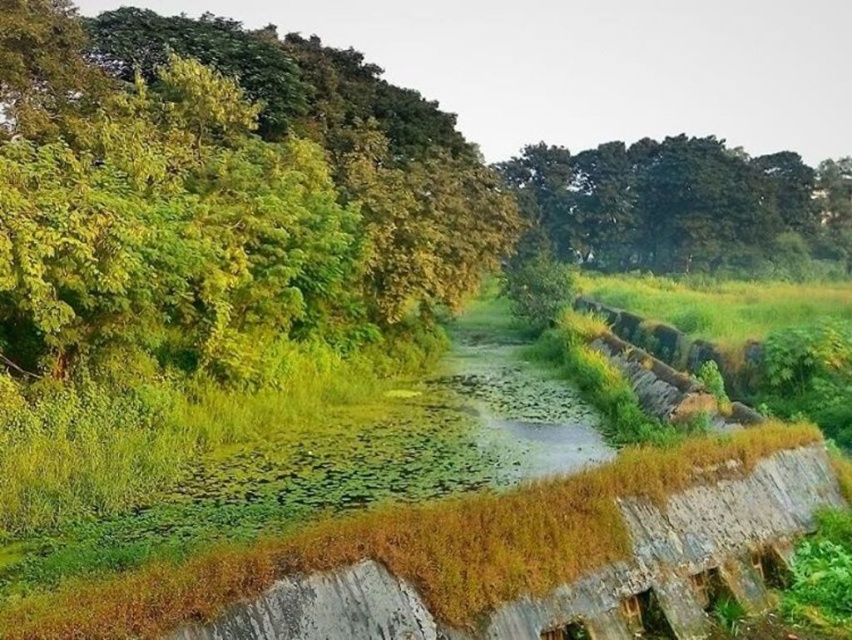
Question: Does green leafy tree at left appear on the right side of green leafy tree at upper center?

Choices:
 (A) yes
 (B) no

Answer: (B)

Question: Is green leafy tree at left to the right of green leafy tree at upper center from the viewer's perspective?

Choices:
 (A) no
 (B) yes

Answer: (A)

Question: Which of the following is the farthest from the observer?

Choices:
 (A) green leafy tree at upper center
 (B) green leafy tree at left

Answer: (A)

Question: Does green leafy tree at left appear over green leafy tree at upper center?

Choices:
 (A) yes
 (B) no

Answer: (B)

Question: Among these points, which one is farthest from the camera?

Choices:
 (A) click(x=550, y=150)
 (B) click(x=91, y=192)

Answer: (A)

Question: Which point is farther to the camera?

Choices:
 (A) green leafy tree at left
 (B) green leafy tree at upper center

Answer: (B)